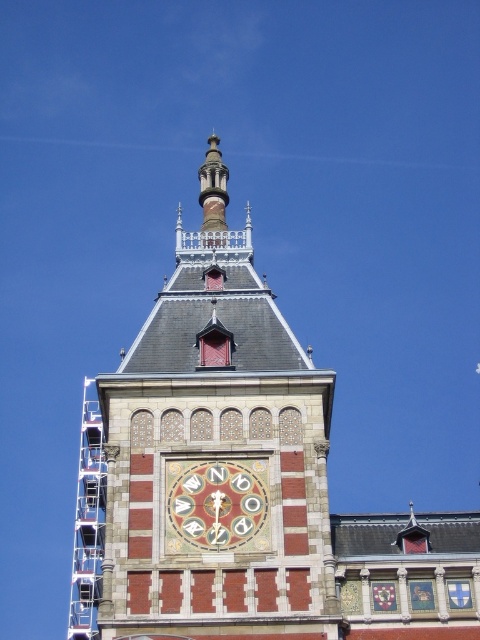
Question: Which of the following is the closest to the observer?

Choices:
 (A) (x=78, y=620)
 (B) (x=182, y=524)

Answer: (B)

Question: Does brick clock tower at upper center appear under metal scaffolding at left?

Choices:
 (A) yes
 (B) no

Answer: (B)

Question: Does brick clock tower at upper center have a greater width compared to metal scaffolding at left?

Choices:
 (A) yes
 (B) no

Answer: (A)

Question: Where is brick clock tower at upper center located in relation to marble clock face at center in the image?

Choices:
 (A) left
 (B) right

Answer: (B)

Question: Which object appears farthest from the camera in this image?

Choices:
 (A) metal scaffolding at left
 (B) marble clock face at center

Answer: (A)

Question: Among these objects, which one is farthest from the camera?

Choices:
 (A) metal scaffolding at left
 (B) marble clock face at center

Answer: (A)